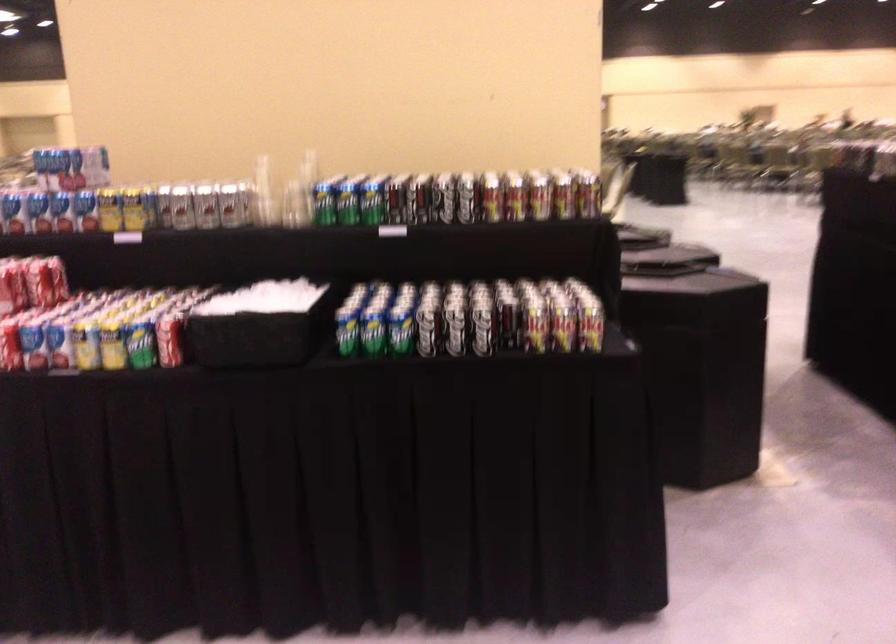
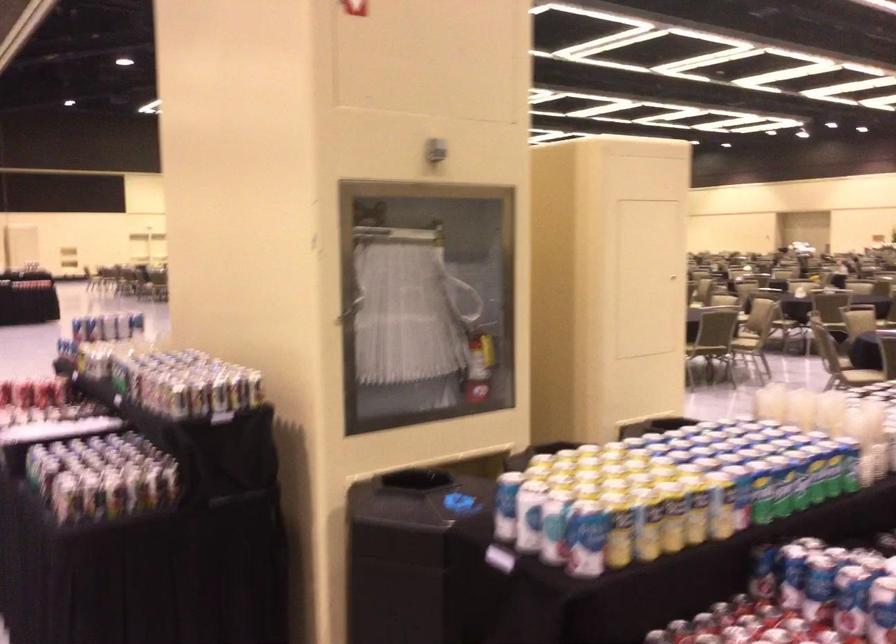
Question: I am providing you with two images of the same scene from different viewpoints. Which of the following objects are not visible in image2?

Choices:
 (A) cabinet door handle
 (B) small beverage bottle
 (C) blue soda can
 (D) blue wipes package

Answer: (C)